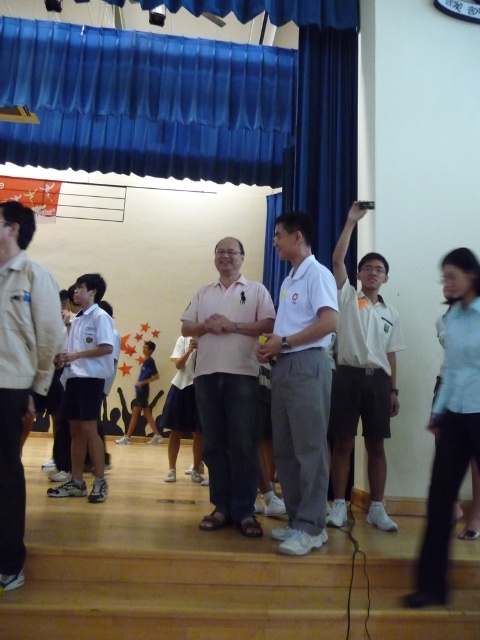
Between white cotton shirt at center and light blue shirt at right, which one appears on the left side from the viewer's perspective?

white cotton shirt at center is more to the left.

Is point (288, 340) in front of point (448, 326)?

No, it is not.

The image size is (480, 640). I want to click on white cotton shirt at center, so click(x=300, y=385).

Locate an element on the screen. This screenshot has width=480, height=640. pink fabric shirt at center is located at coordinates (228, 385).

Where is `pink fabric shirt at center`? The width and height of the screenshot is (480, 640). pink fabric shirt at center is located at coordinates (228, 385).

What are the coordinates of `pink fabric shirt at center` in the screenshot? It's located at (228, 385).

Which is in front, point (286, 502) or point (365, 438)?

Point (286, 502) is more forward.

Which is behind, point (297, 284) or point (388, 352)?

Positioned behind is point (388, 352).

What are the coordinates of `white cotton shirt at center` in the screenshot? It's located at (300, 385).